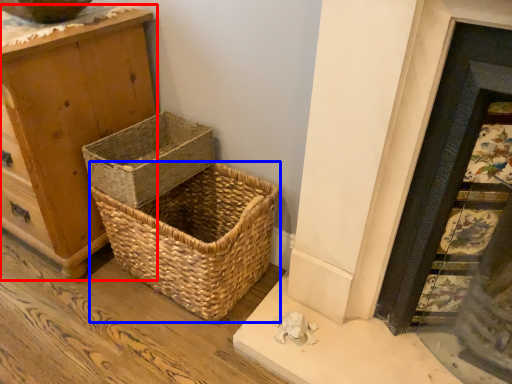
Question: Which point is closer to the camera, chest of drawers (highlighted by a red box) or picnic basket (highlighted by a blue box)?

Choices:
 (A) chest of drawers
 (B) picnic basket

Answer: (A)